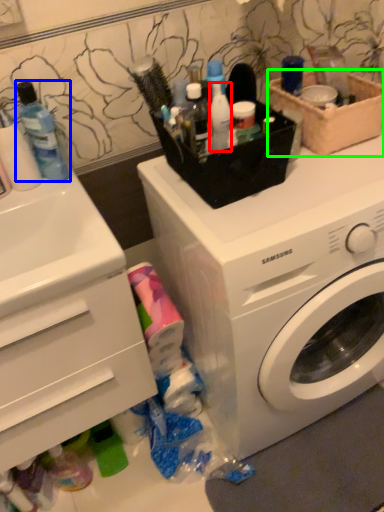
Question: Which object is the farthest from toiletry (highlighted by a red box)? Choose among these: mouthwash (highlighted by a blue box) or basket (highlighted by a green box).

Choices:
 (A) mouthwash
 (B) basket

Answer: (A)